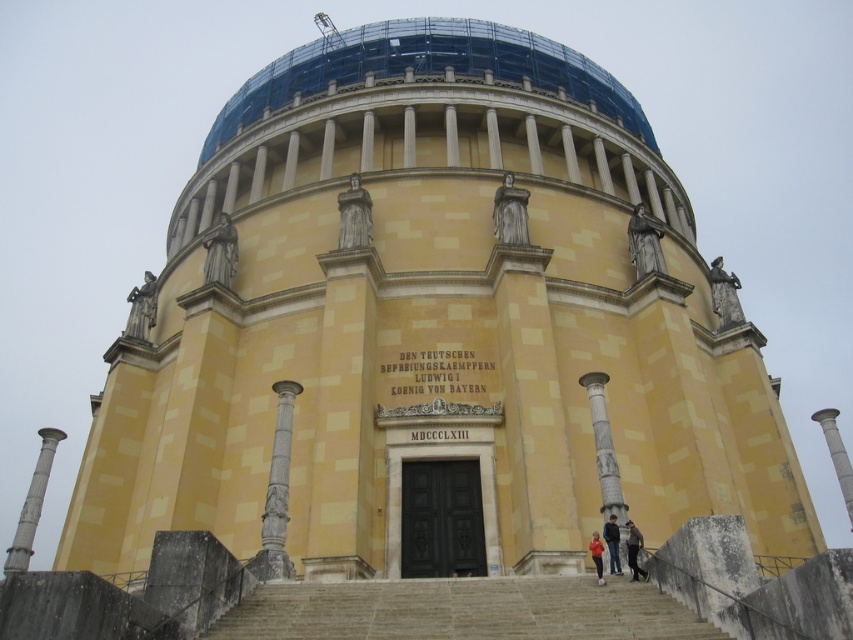
You are an architect examining the building plans and notice the white marble column at right. According to the coordinates provided, where exactly is this column positioned in relation to the entrance columns?

The white marble column at right is located at point 0.711 on the x axis and 0.981 on the y axis, which places it near the bottom right corner of the structure, far from the entrance columns.

What is the position of the point with coordinates (836, 454) in relation to the white marble column at right?

The point with coordinates (836, 454) is located on the white marble column at right.

What is the position of the point labeled as point (645,243) in relation to the stone statue at right?

The point labeled as point (645,243) is located on the stone statue at right.